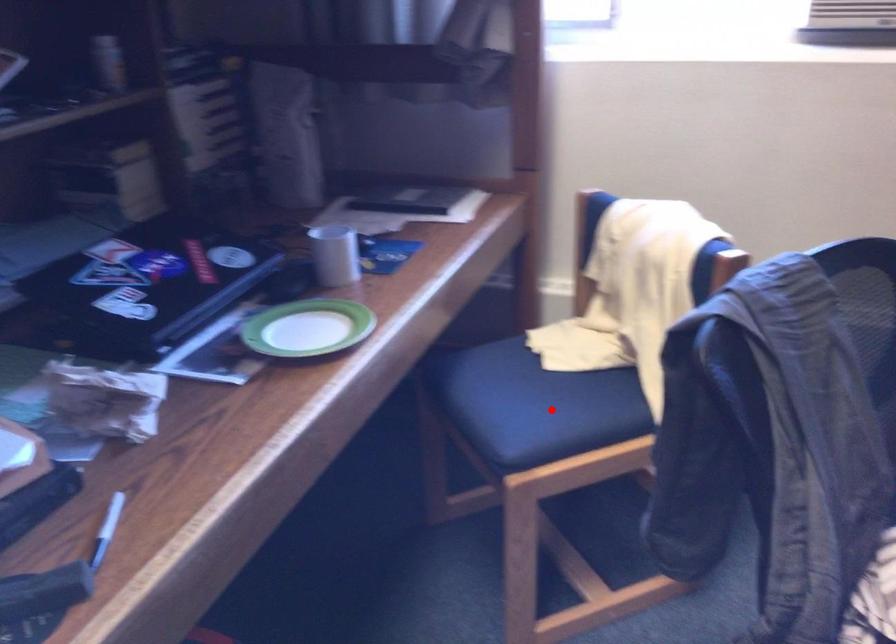
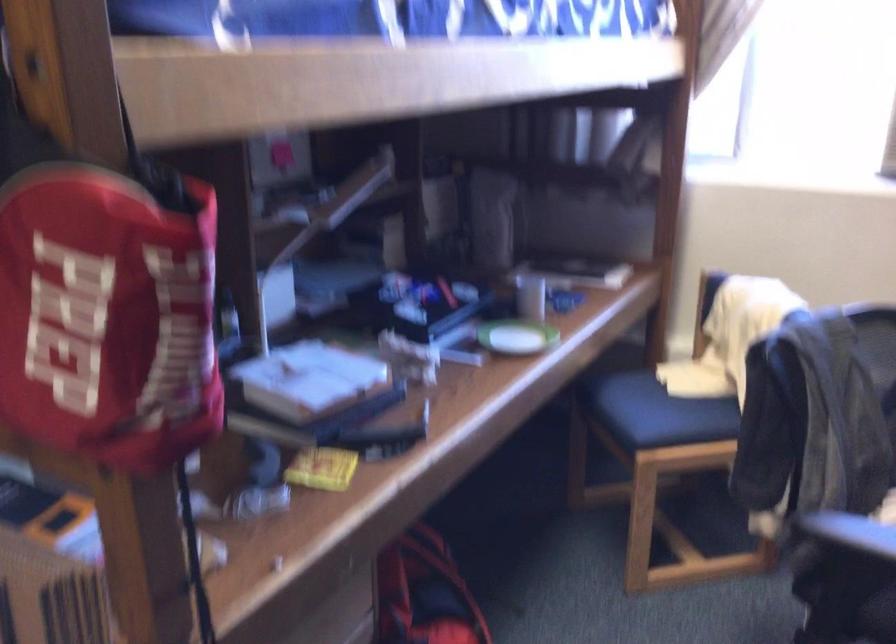
Question: I am providing you with two images of the same scene from different viewpoints. A red point is marked on the first image. Can you still see the location of the red point in image 2?

Choices:
 (A) Yes
 (B) No

Answer: (A)